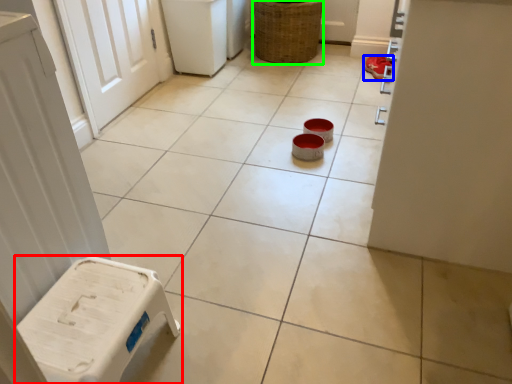
Question: Which is farther away from furniture (highlighted by a red box)? footwear (highlighted by a blue box) or basket (highlighted by a green box)?

Choices:
 (A) footwear
 (B) basket

Answer: (B)